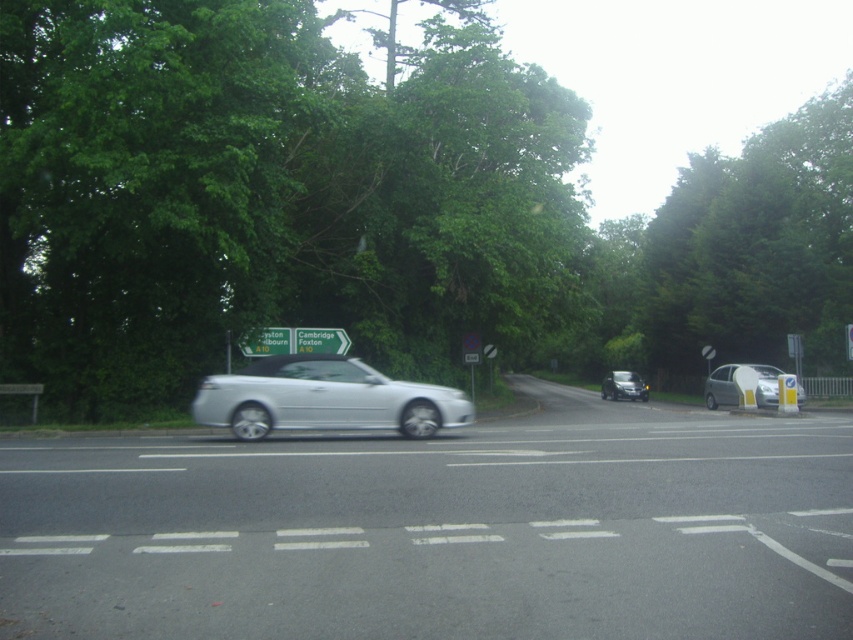
Does point (271, 401) lie in front of point (300, 330)?

Yes, point (271, 401) is in front of point (300, 330).

Find the location of a particular element. silver metallic car at center is located at coordinates (323, 397).

Does green leafy tree at center have a larger size compared to silver metallic car at center?

Yes.

Which is more to the right, green leafy tree at center or silver metallic car at center?

green leafy tree at center is more to the right.

The height and width of the screenshot is (640, 853). I want to click on green leafy tree at center, so click(x=366, y=209).

Does green plastic signpost at upper center appear over green plastic sign at center?

No.

Is green plastic signpost at upper center thinner than green plastic sign at center?

Yes.

Locate an element on the screen. The width and height of the screenshot is (853, 640). green plastic signpost at upper center is located at coordinates (267, 340).

This screenshot has height=640, width=853. Find the location of `green plastic signpost at upper center`. green plastic signpost at upper center is located at coordinates (267, 340).